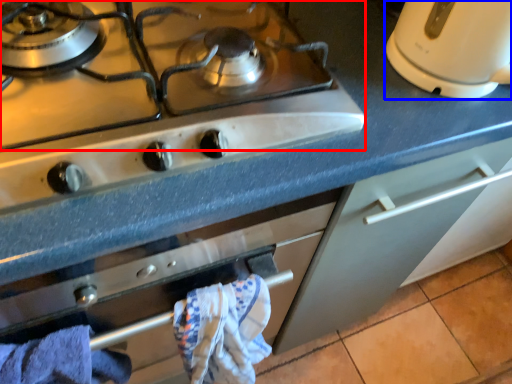
Question: Among these objects, which one is farthest to the camera, gas stove (highlighted by a red box) or kitchen appliance (highlighted by a blue box)?

Choices:
 (A) gas stove
 (B) kitchen appliance

Answer: (B)